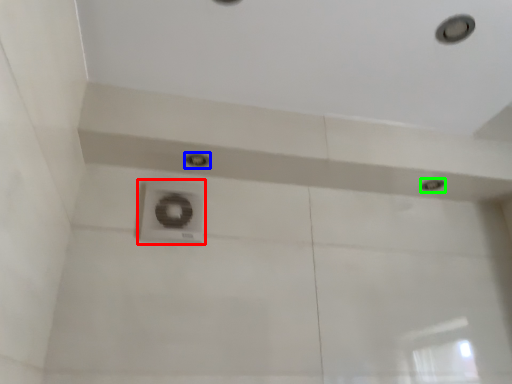
Question: Estimate the real-world distances between objects in this image. Which object is farther from plumbing fixture (highlighted by a red box), droplight (highlighted by a blue box) or droplight (highlighted by a green box)?

Choices:
 (A) droplight
 (B) droplight

Answer: (B)